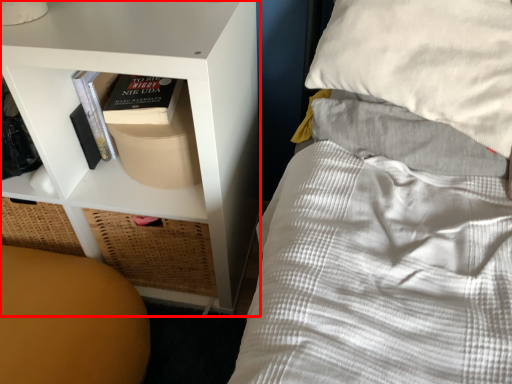
Question: Observing the image, what is the correct spatial positioning of shelf (annotated by the red box) in reference to furniture?

Choices:
 (A) right
 (B) left

Answer: (A)